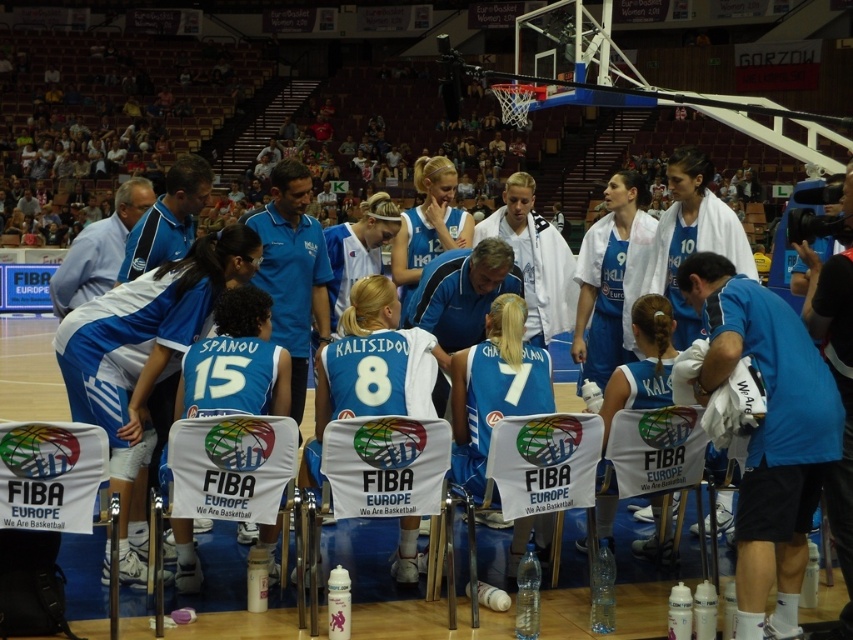
Between blue fabric shirt at center and white jersey at center, which one has more height?

white jersey at center

Between point (817, 422) and point (108, 400), which one is positioned behind?

The point (108, 400) is more distant.

Does point (791, 509) come in front of point (157, 308)?

Yes, point (791, 509) is in front of point (157, 308).

Find the location of `blue fabric shirt at center`. blue fabric shirt at center is located at coordinates 767,433.

Can you confirm if blue fabric shirt at center is thinner than matte blue jersey at center?

No.

Can you confirm if blue fabric shirt at center is smaller than matte blue jersey at center?

Incorrect, blue fabric shirt at center is not smaller in size than matte blue jersey at center.

Who is more distant from viewer, (813, 433) or (444, 580)?

Point (444, 580)

This screenshot has height=640, width=853. I want to click on blue fabric shirt at center, so click(767, 433).

Does white jersey at center come in front of matte blue jersey at center?

Yes, white jersey at center is in front of matte blue jersey at center.

Between point (115, 388) and point (207, 560), which one is positioned behind?

The point (207, 560) is more distant.

The height and width of the screenshot is (640, 853). What are the coordinates of `white jersey at center` in the screenshot? It's located at (144, 353).